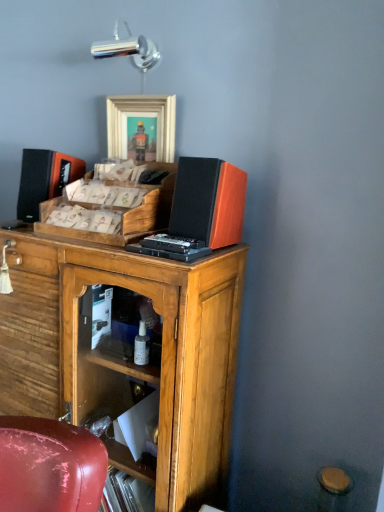
What do you see at coordinates (44, 179) in the screenshot? The image size is (384, 512). I see `matte black speaker at upper left` at bounding box center [44, 179].

The image size is (384, 512). I want to click on wooden tray at center, so click(x=122, y=214).

Locate an element on the screen. This screenshot has height=512, width=384. wooden picture frame at upper center is located at coordinates (143, 121).

Measure the distance between point (128,308) and camera.

The distance of point (128,308) from camera is 4.63 feet.

The height and width of the screenshot is (512, 384). Find the location of `matte black speaker at upper left`. matte black speaker at upper left is located at coordinates (44, 179).

Is matte black speaker at upper left inside or outside of wooden cabinet at center?

matte black speaker at upper left is spatially situated outside wooden cabinet at center.

Between point (30, 188) and point (151, 403), which one is positioned in front?

The point (151, 403) is in front.

Considering the positions of objects matte black speaker at upper left and wooden cabinet at center in the image provided, who is more to the left, matte black speaker at upper left or wooden cabinet at center?

matte black speaker at upper left.

Is matte black speaker at upper left positioned with its back to wooden cabinet at center?

No, matte black speaker at upper left is not facing away from wooden cabinet at center.

In terms of height, does wooden cabinet at center look taller or shorter compared to wooden picture frame at upper center?

In the image, wooden cabinet at center appears to be taller than wooden picture frame at upper center.

Is wooden cabinet at center to the left of wooden picture frame at upper center from the viewer's perspective?

Yes.

Is wooden cabinet at center thinner than wooden picture frame at upper center?

No.

Relative to wooden picture frame at upper center, is wooden cabinet at center in front or behind?

wooden cabinet at center is positioned closer to the viewer than wooden picture frame at upper center.

Is wooden picture frame at upper center bigger or smaller than wooden tray at center?

wooden picture frame at upper center is smaller than wooden tray at center.

Considering the relative sizes of wooden picture frame at upper center and wooden tray at center in the image provided, is wooden picture frame at upper center thinner than wooden tray at center?

Yes.

From a real-world perspective, is wooden picture frame at upper center over wooden tray at center?

Yes.

Between wooden picture frame at upper center and wooden tray at center, which one has less height?

wooden picture frame at upper center.

How many degrees apart are the facing directions of wooden cabinet at center and orange matte speaker at upper right?

wooden cabinet at center and orange matte speaker at upper right are facing 4.73 degrees away from each other.

From the image's perspective, between wooden cabinet at center and orange matte speaker at upper right, who is located below?

From the image's view, wooden cabinet at center is below.

Image resolution: width=384 pixels, height=512 pixels. Identify the location of computer located above the wooden cabinet at center (from the image's perspective). (200, 211).

From a real-world perspective, does orange matte speaker at upper right sit lower than wooden tray at center?

No, from a real-world perspective, orange matte speaker at upper right is not below wooden tray at center.

Between orange matte speaker at upper right and wooden tray at center, which one has smaller size?

orange matte speaker at upper right is smaller.

Is the position of orange matte speaker at upper right more distant than that of wooden tray at center?

No, orange matte speaker at upper right is in front of wooden tray at center.

Is wooden picture frame at upper center taller or shorter than orange matte speaker at upper right?

Considering their sizes, wooden picture frame at upper center has more height than orange matte speaker at upper right.

Does wooden picture frame at upper center turn towards orange matte speaker at upper right?

No, wooden picture frame at upper center is not turned towards orange matte speaker at upper right.

From a real-world perspective, is wooden picture frame at upper center above or below orange matte speaker at upper right?

wooden picture frame at upper center is situated higher than orange matte speaker at upper right in the real world.

Does wooden tray at center contain orange matte speaker at upper right?

No, orange matte speaker at upper right is located outside of wooden tray at center.

Considering the positions of objects wooden tray at center and orange matte speaker at upper right in the image provided, who is more to the left, wooden tray at center or orange matte speaker at upper right?

Positioned to the left is wooden tray at center.

From the image's perspective, is wooden tray at center on top of orange matte speaker at upper right?

Yes, from the image's perspective, wooden tray at center is over orange matte speaker at upper right.

Is wooden tray at center positioned behind orange matte speaker at upper right?

Yes.

The image size is (384, 512). What are the coordinates of `speaker above the wooden cabinet at center (from the image's perspective)` in the screenshot? It's located at (44, 179).

The width and height of the screenshot is (384, 512). I want to click on picture frame that appears behind the wooden cabinet at center, so click(143, 121).

From the picture: Which object lies further to the anchor point matte black speaker at upper left, wooden picture frame at upper center or wooden tray at center?

Based on the image, wooden picture frame at upper center appears to be further to matte black speaker at upper left.

Which object lies further to the anchor point wooden cabinet at center, matte black speaker at upper left or orange matte speaker at upper right?

matte black speaker at upper left lies further to wooden cabinet at center than the other object.

From the image, which object appears to be nearer to wooden tray at center, orange matte speaker at upper right or wooden picture frame at upper center?

Among the two, orange matte speaker at upper right is located nearer to wooden tray at center.

Based on their spatial positions, is wooden picture frame at upper center or orange matte speaker at upper right further from wooden cabinet at center?

The object further to wooden cabinet at center is wooden picture frame at upper center.

In the scene shown: Estimate the real-world distances between objects in this image. Which object is closer to wooden cabinet at center, matte black speaker at upper left or wooden tray at center?

Based on the image, wooden tray at center appears to be nearer to wooden cabinet at center.

Looking at the image, which one is located further to wooden picture frame at upper center, matte black speaker at upper left or wooden cabinet at center?

wooden cabinet at center lies further to wooden picture frame at upper center than the other object.

Based on their spatial positions, is matte black speaker at upper left or wooden picture frame at upper center closer to wooden tray at center?

The object closer to wooden tray at center is matte black speaker at upper left.

Which object lies further to the anchor point orange matte speaker at upper right, wooden cabinet at center or wooden picture frame at upper center?

wooden picture frame at upper center.

Locate an element on the screen. computer between wooden tray at center and wooden cabinet at center in the vertical direction is located at coordinates (200, 211).

You are a GUI agent. You are given a task and a screenshot of the screen. Output one action in this format:
    pyautogui.click(x=<x>, y=<y>)
    Task: Click on the desk between wooden picture frame at upper center and wooden cabinet at center from top to bottom
    Image resolution: width=384 pixels, height=512 pixels.
    Given the screenshot: What is the action you would take?
    pyautogui.click(x=122, y=214)

Where is `desk between matte black speaker at upper left and wooden cabinet at center in the up-down direction`? This screenshot has width=384, height=512. desk between matte black speaker at upper left and wooden cabinet at center in the up-down direction is located at coordinates (122, 214).

Locate an element on the screen. picture frame between matte black speaker at upper left and orange matte speaker at upper right is located at coordinates (143, 121).